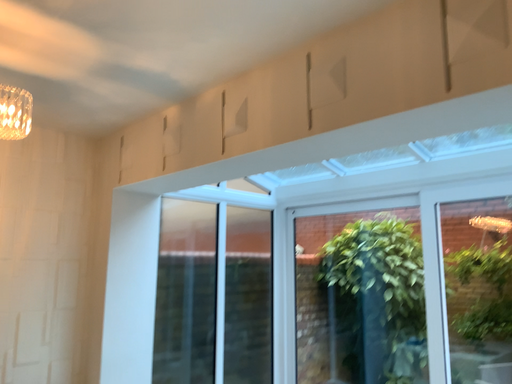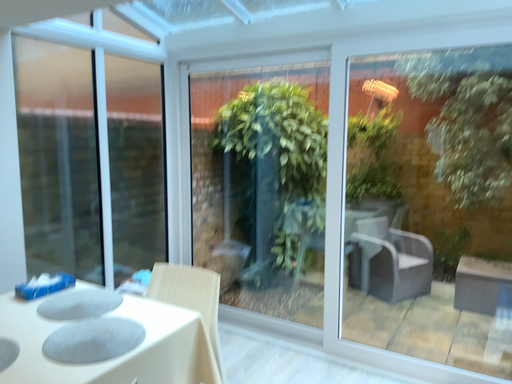
Question: How did the camera likely rotate when shooting the video?

Choices:
 (A) rotated downward
 (B) rotated upward

Answer: (A)